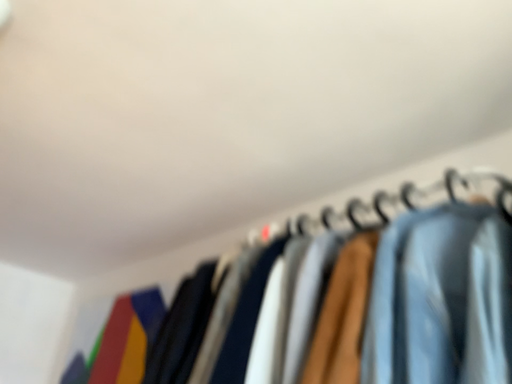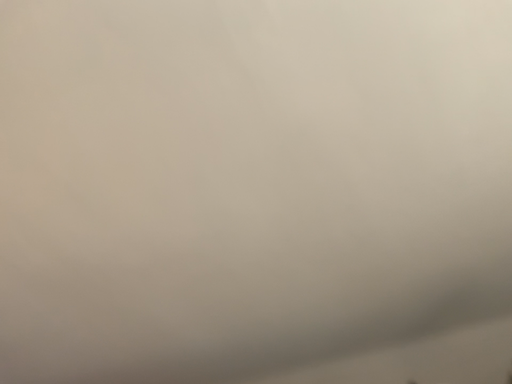
Question: Which way did the camera rotate in the video?

Choices:
 (A) rotated upward
 (B) rotated downward

Answer: (A)